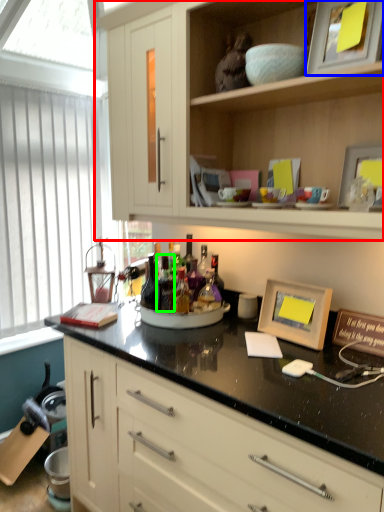
Question: Which object is positioned farthest from cabinetry (highlighted by a red box)? Select from picture frame (highlighted by a blue box) and bottle (highlighted by a green box).

Choices:
 (A) picture frame
 (B) bottle

Answer: (B)